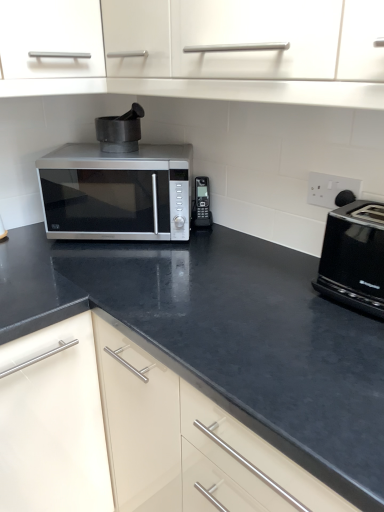
Question: From the image's perspective, is black plastic phone at center, the first appliance when ordered from bottom to top, over white plastic electric outlet at upper right?

Choices:
 (A) no
 (B) yes

Answer: (B)

Question: Considering the relative sizes of black plastic phone at center, which appears as the second appliance when viewed from the left, and white plastic electric outlet at upper right in the image provided, is black plastic phone at center, which appears as the second appliance when viewed from the left, shorter than white plastic electric outlet at upper right?

Choices:
 (A) no
 (B) yes

Answer: (A)

Question: From a real-world perspective, does black plastic phone at center, which appears as the second appliance when viewed from the left, sit lower than white plastic electric outlet at upper right?

Choices:
 (A) yes
 (B) no

Answer: (A)

Question: Is black plastic phone at center, which appears as the second appliance when viewed from the left, bigger than white plastic electric outlet at upper right?

Choices:
 (A) yes
 (B) no

Answer: (A)

Question: Is black plastic phone at center, which appears as the second appliance when viewed from the left, oriented towards white plastic electric outlet at upper right?

Choices:
 (A) yes
 (B) no

Answer: (B)

Question: Does black plastic phone at center, acting as the 1th appliance starting from the right, appear on the left side of white plastic electric outlet at upper right?

Choices:
 (A) yes
 (B) no

Answer: (A)

Question: Does black plastic phone at center, the first appliance when ordered from bottom to top, have a larger size compared to black matte mortar at center, the 1th appliance from the top?

Choices:
 (A) yes
 (B) no

Answer: (B)

Question: Does black plastic phone at center, the first appliance when ordered from bottom to top, have a smaller size compared to black matte mortar at center, the second appliance from the bottom?

Choices:
 (A) no
 (B) yes

Answer: (B)

Question: Could you tell me if black plastic phone at center, the first appliance when ordered from bottom to top, is facing black matte mortar at center, which is the second appliance in right-to-left order?

Choices:
 (A) no
 (B) yes

Answer: (A)

Question: Does black plastic phone at center, which appears as the second appliance when viewed from the left, have a lesser width compared to black matte mortar at center, the 1th appliance from the top?

Choices:
 (A) yes
 (B) no

Answer: (A)

Question: Is black plastic phone at center, the first appliance when ordered from bottom to top, at the right side of black matte mortar at center, the second appliance from the bottom?

Choices:
 (A) yes
 (B) no

Answer: (A)

Question: Can black matte mortar at center, the 1th appliance from the top, be found inside black plastic phone at center, acting as the 1th appliance starting from the right?

Choices:
 (A) no
 (B) yes

Answer: (A)

Question: Considering the relative sizes of white plastic electric outlet at upper right and satin silver microwave at center in the image provided, is white plastic electric outlet at upper right wider than satin silver microwave at center?

Choices:
 (A) yes
 (B) no

Answer: (B)